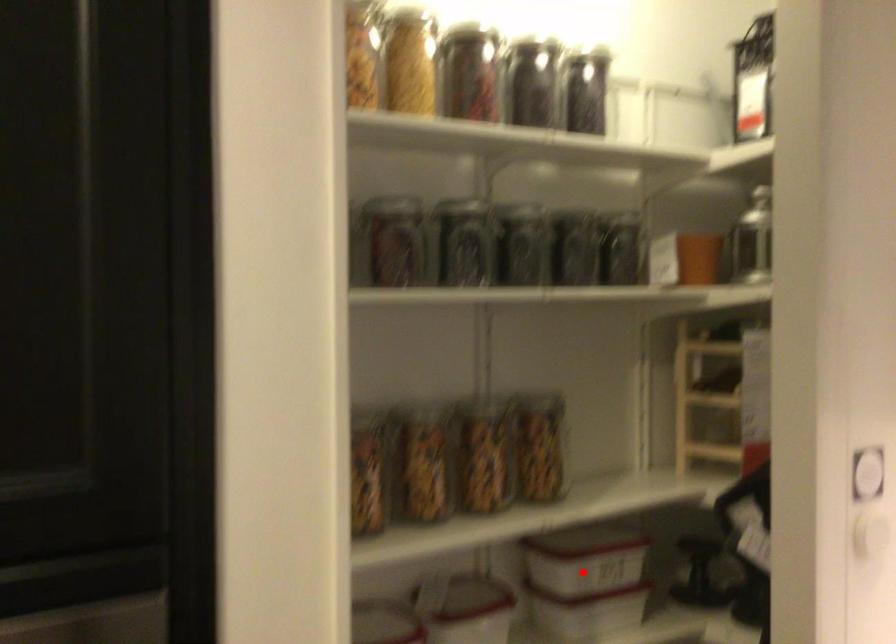
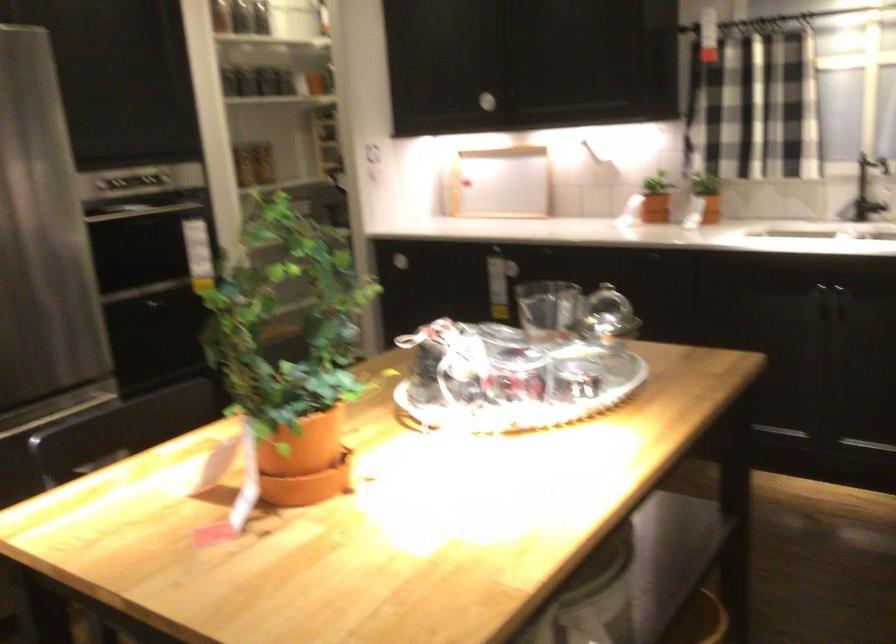
Question: I am providing you with two images of the same scene from different viewpoints. A red point is marked on the first image. Can you still see the location of the red point in image 2?

Choices:
 (A) Yes
 (B) No

Answer: (B)